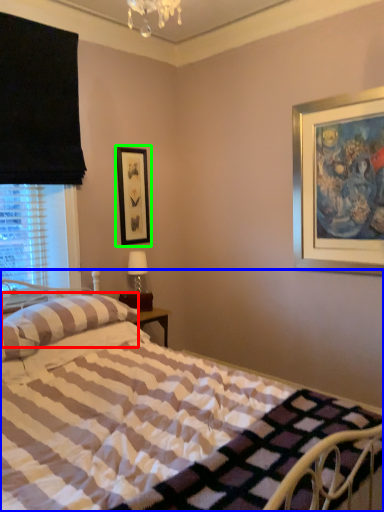
Question: Estimate the real-world distances between objects in this image. Which object is farther from pillow (highlighted by a red box), bed (highlighted by a blue box) or picture frame (highlighted by a green box)?

Choices:
 (A) bed
 (B) picture frame

Answer: (B)